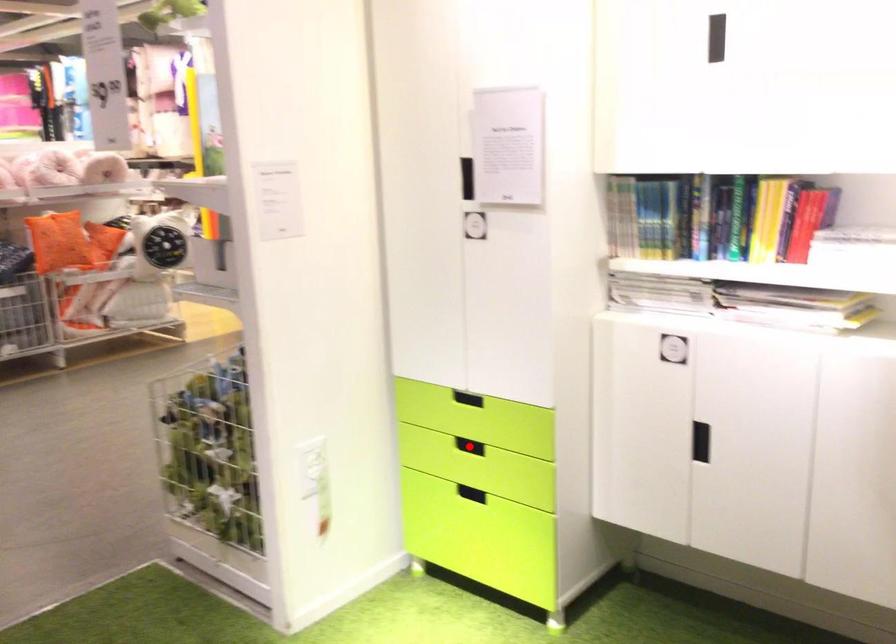
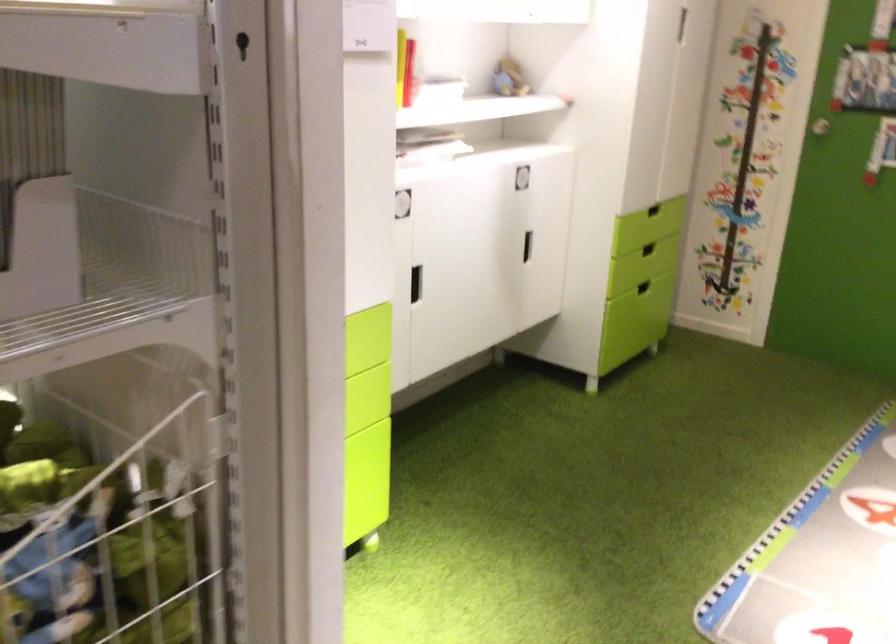
Question: I am providing you with two images of the same scene from different viewpoints. A red point is marked on the first image. Can you still see the location of the red point in image 2?

Choices:
 (A) Yes
 (B) No

Answer: (B)